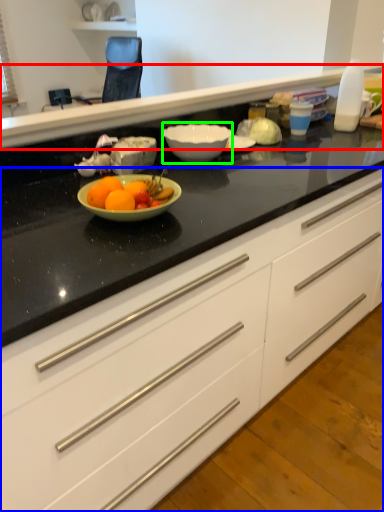
Question: Estimate the real-world distances between objects in this image. Which object is closer to counter top (highlighted by a red box), cabinetry (highlighted by a blue box) or bowl (highlighted by a green box)?

Choices:
 (A) cabinetry
 (B) bowl

Answer: (B)